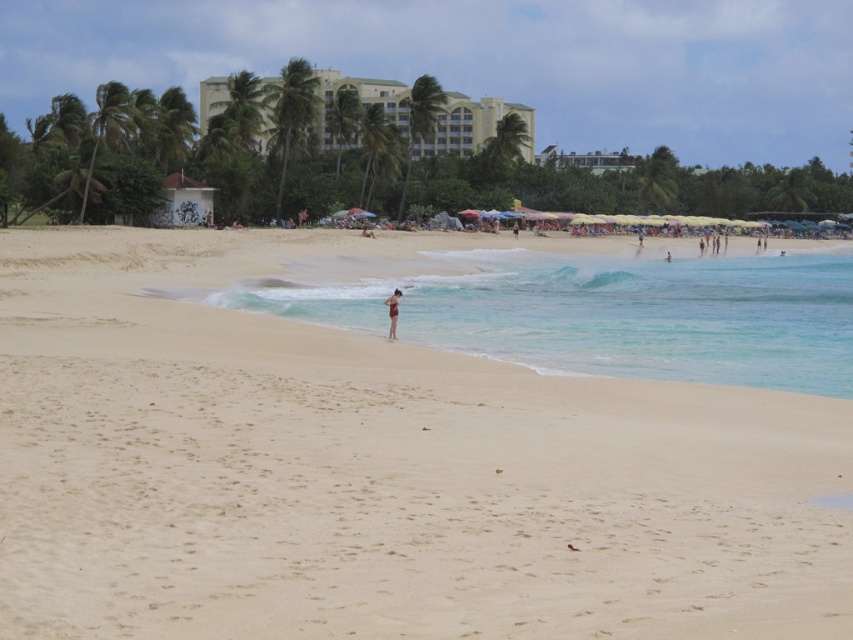
Between light beige sand at center and clear blue water at center, which one appears on the left side from the viewer's perspective?

light beige sand at center is more to the left.

Can you confirm if light beige sand at center is positioned to the right of clear blue water at center?

No, light beige sand at center is not to the right of clear blue water at center.

The height and width of the screenshot is (640, 853). Find the location of `light beige sand at center`. light beige sand at center is located at coordinates (376, 467).

Does clear blue water at center lie in front of smooth tan skin at center?

Yes, clear blue water at center is closer to the viewer.

Measure the distance between point [751,291] and camera.

Point [751,291] and camera are 60.30 meters apart from each other.

Identify the location of clear blue water at center. (611, 314).

Can you confirm if light beige sand at center is positioned below beige concrete building at upper center?

Correct, light beige sand at center is located below beige concrete building at upper center.

Does light beige sand at center appear on the right side of beige concrete building at upper center?

Yes, light beige sand at center is to the right of beige concrete building at upper center.

Who is more forward, (311, 588) or (364, 83)?

Point (311, 588) is in front.

The image size is (853, 640). Find the location of `light beige sand at center`. light beige sand at center is located at coordinates (376, 467).